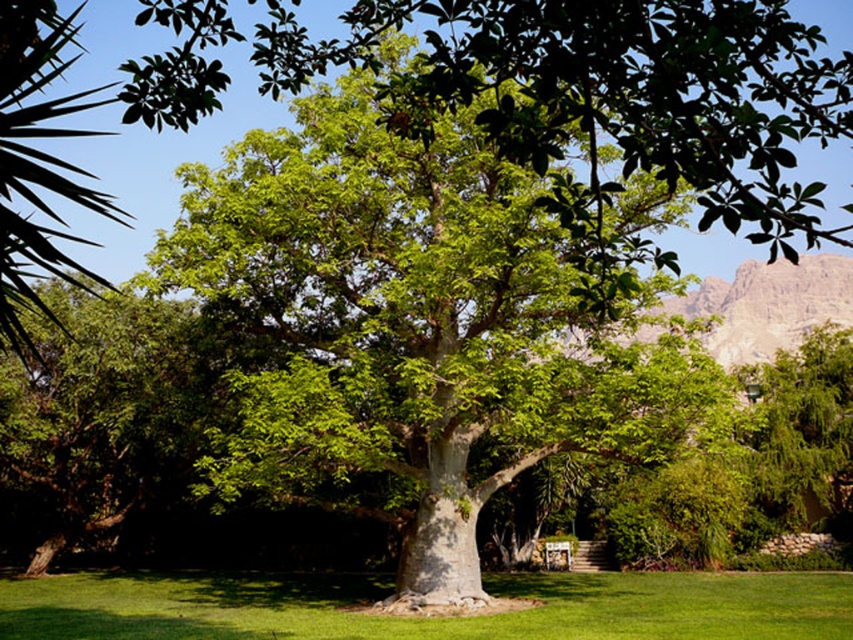
Question: Does green leafy oak tree at center have a smaller size compared to green grass at center?

Choices:
 (A) no
 (B) yes

Answer: (A)

Question: Among these points, which one is farthest from the camera?

Choices:
 (A) (259, 205)
 (B) (33, 588)
 (C) (32, 179)

Answer: (B)

Question: Which point appears closest to the camera in this image?

Choices:
 (A) (738, 595)
 (B) (236, 445)

Answer: (B)

Question: Is green grass at center positioned in front of green leafy plant at left?

Choices:
 (A) no
 (B) yes

Answer: (A)

Question: In this image, where is green leafy oak tree at center located relative to green leafy plant at left?

Choices:
 (A) below
 (B) above

Answer: (A)

Question: Which object appears closest to the camera in this image?

Choices:
 (A) green grass at center
 (B) green leafy oak tree at center

Answer: (B)